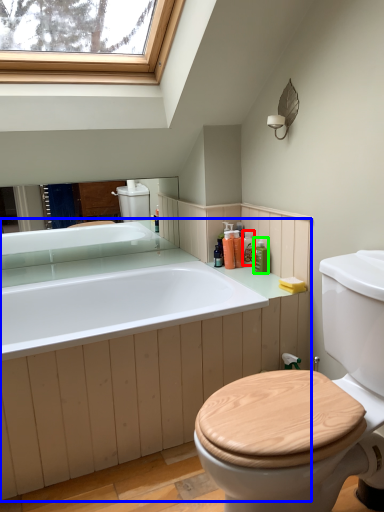
Question: Which object is positioned closest to toiletry (highlighted by a red box)? Select from counter top (highlighted by a blue box) and toiletry (highlighted by a green box).

Choices:
 (A) counter top
 (B) toiletry

Answer: (B)